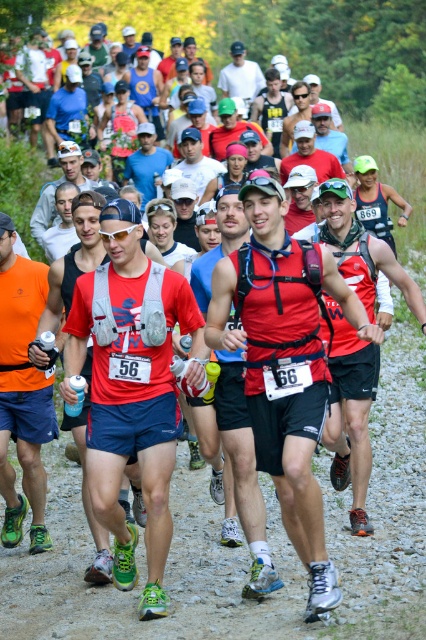
You are a photographer positioned at the starting line of the trail race. You want to capture a photo of the two runners wearing the matte gray vest at center and the matte black cap at center. From your position, which item is positioned to the left?

The matte gray vest at center is to the left of the matte black cap at center, so the matte gray vest at center is positioned to the left.